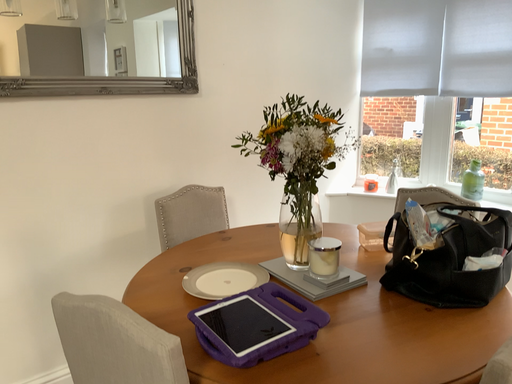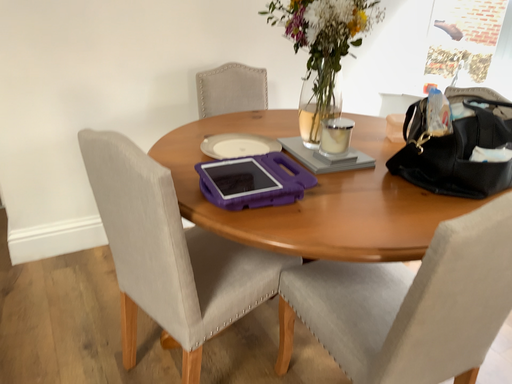
Question: How did the camera likely rotate when shooting the video?

Choices:
 (A) rotated downward
 (B) rotated upward

Answer: (A)